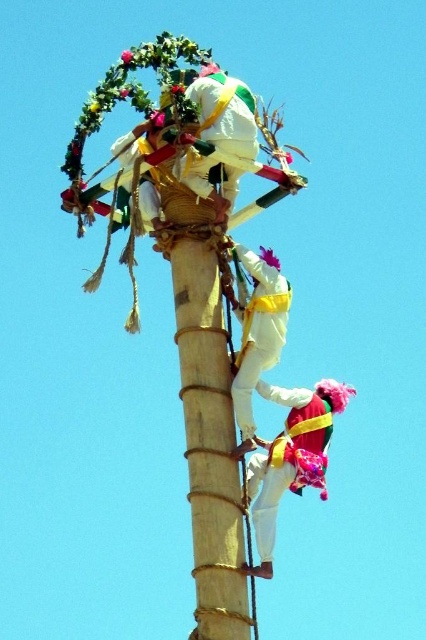
You are a participant in this traditional climbing event. You have to climb the bamboo pole and reach the top wreath. You see the white matte fabric at upper center and the white matte climbing harness at center. Which object should you grab first to progress upward?

You should grab the white matte climbing harness at center first since the white matte fabric at upper center is located above it, meaning the harness is lower and part of the climbing path.

You are an event organizer planning to set up a safety net for the bamboo pole at center and the matte pink fabric at center. The safety net requires a minimum distance of 4 meters between the two objects to be effective. Based on the scene description, will the safety net be effective?

The bamboo pole at center and matte pink fabric at center are 5.03 meters apart from each other, which exceeds the minimum required distance of 4 meters. Therefore, the safety net will be effective.